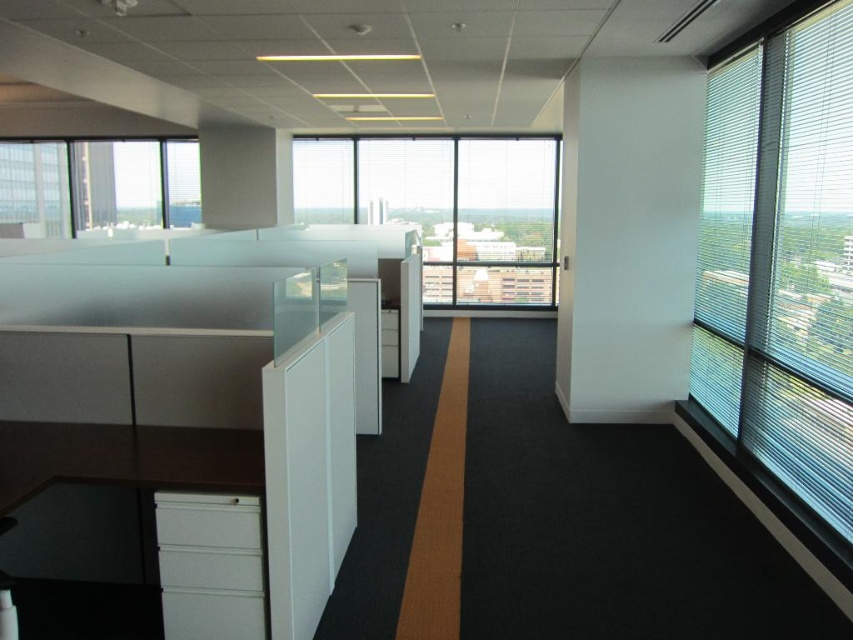
You are an office worker who wants to let in more sunlight into your workspace. You have two windows available, the transparent glass window at right and the clear glass window at upper left. Which window should you open to allow more sunlight to enter your area?

The transparent glass window at right is taller than the clear glass window at upper left, so opening the transparent glass window at right would allow more sunlight into your area due to its greater height.